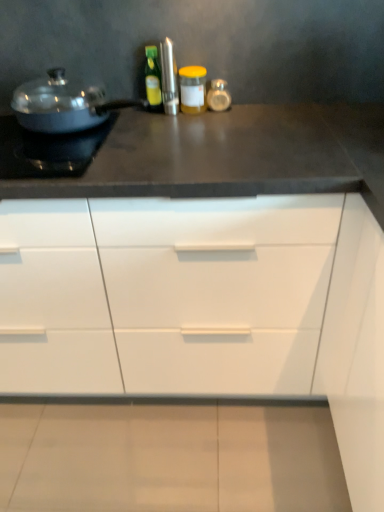
Identify the location of empty space that is to the right of yellow matte jar at center, arranged as the 2th bottle when viewed from the left. (245, 110).